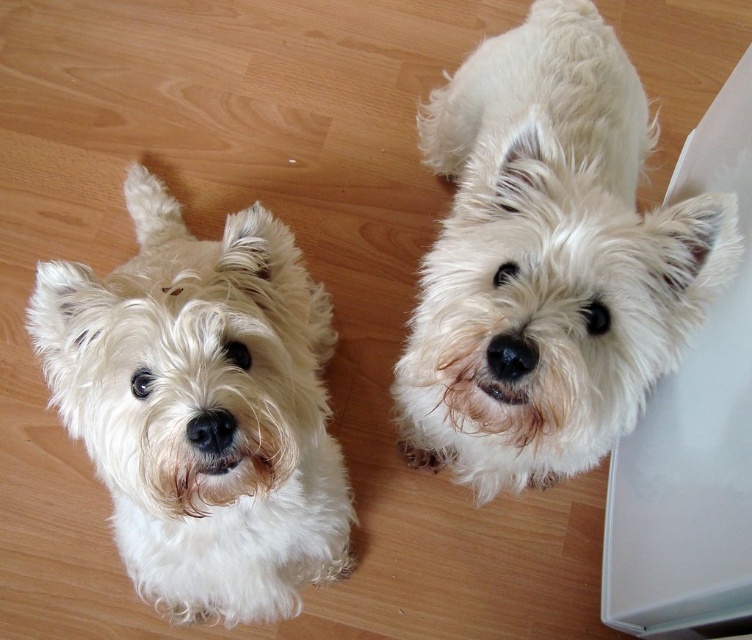
Question: Is white fluffy dog at upper center to the right of white fluffy dog at center from the viewer's perspective?

Choices:
 (A) no
 (B) yes

Answer: (B)

Question: In this image, where is white fluffy dog at upper center located relative to white fluffy dog at center?

Choices:
 (A) right
 (B) left

Answer: (A)

Question: Among these points, which one is farthest from the camera?

Choices:
 (A) (188, 419)
 (B) (605, 45)

Answer: (B)

Question: Is white fluffy dog at upper center to the left of white fluffy dog at center from the viewer's perspective?

Choices:
 (A) yes
 (B) no

Answer: (B)